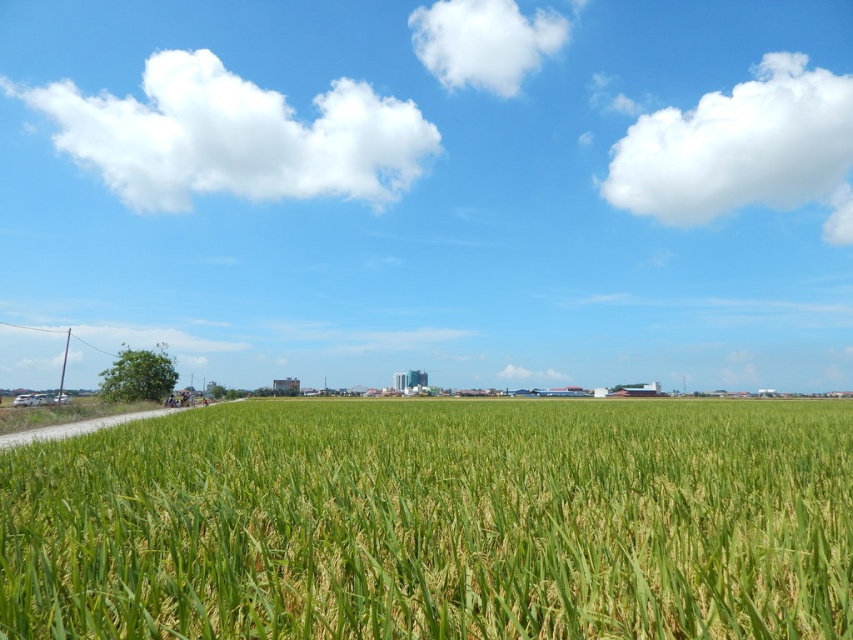
You are a pilot flying a small airplane and you notice two clouds in the sky. The first is the white fluffy cloud at upper left and the second is the white fluffy cloud at upper center. Which cloud is higher in the sky?

The white fluffy cloud at upper left is taller than the white fluffy cloud at upper center, so the white fluffy cloud at upper left is higher in the sky.

You are a farmer standing at the edge of the green grassy wheat field at center and looking towards the white fluffy cloud at upper right. Which object appears taller from your perspective?

The white fluffy cloud at upper right appears taller than the green grassy wheat field at center because the cloud is higher in the sky while the field is on the ground.